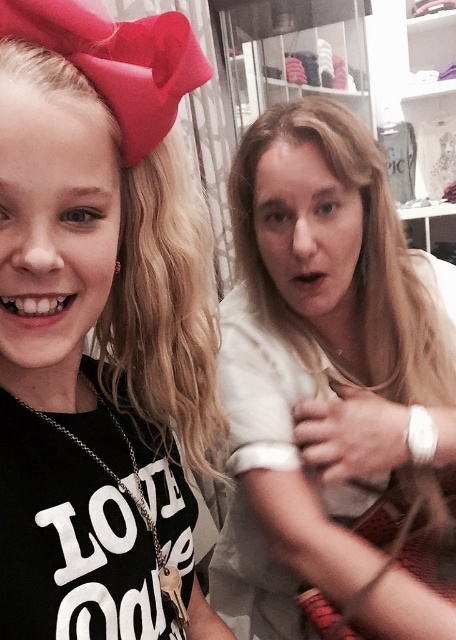
Question: Among these points, which one is farthest from the camera?

Choices:
 (A) (198, 195)
 (B) (279, 557)

Answer: (A)

Question: Which point is farther to the camera?

Choices:
 (A) (357, 637)
 (B) (134, 372)

Answer: (A)

Question: Can you confirm if white matte shirt at center is bigger than blonde curly hair at upper left?

Choices:
 (A) no
 (B) yes

Answer: (B)

Question: Can you confirm if white matte shirt at center is bigger than blonde curly hair at upper left?

Choices:
 (A) yes
 (B) no

Answer: (A)

Question: Does white matte shirt at center have a greater width compared to blonde curly hair at upper left?

Choices:
 (A) no
 (B) yes

Answer: (B)